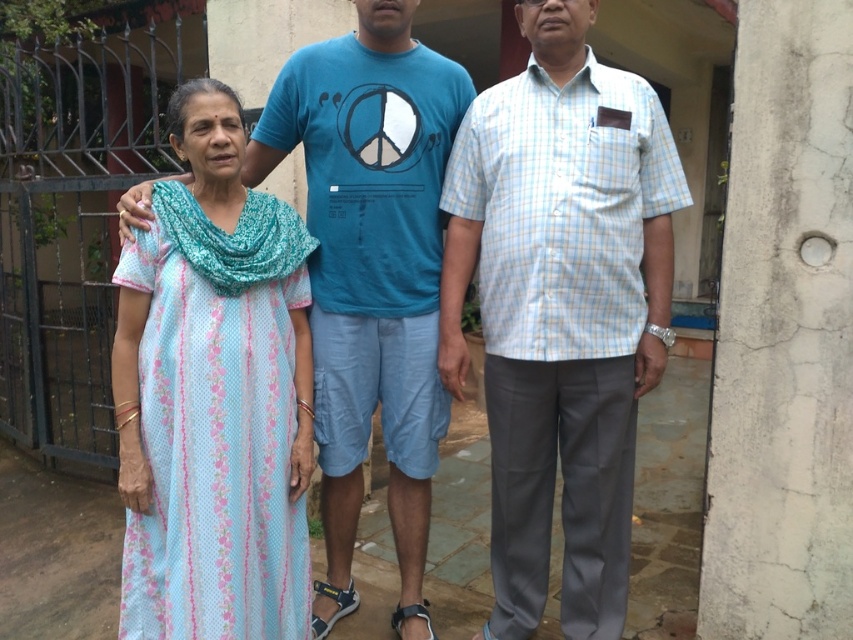
You are a photographer trying to capture a group photo of the light blue checkered shirt at center and the light blue floral dress at center. The camera you have can only focus on objects within 0.5 inches of each other. Will the two subjects be in focus?

The distance between the light blue checkered shirt at center and the light blue floral dress at center is 0.52 inches, which is slightly more than the camera can focus on. Therefore, the two subjects will not be in focus together.